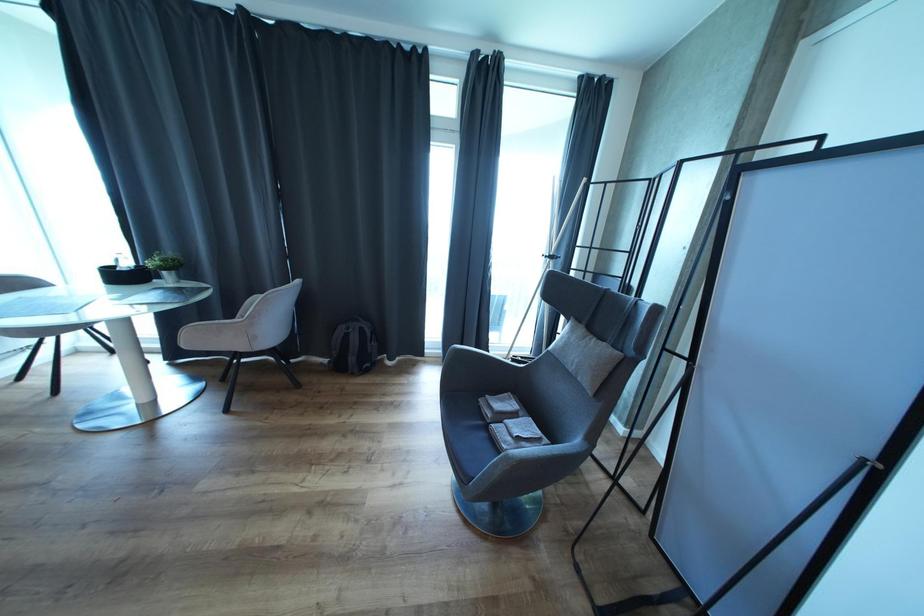
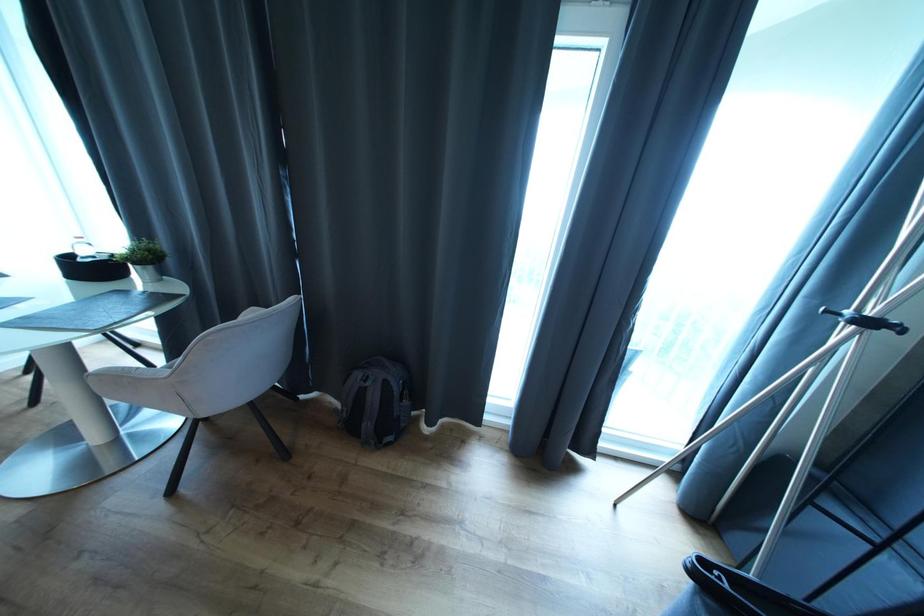
Question: Which direction would the cameraman need to move to produce the second image? Reply with the corresponding letter.

Choices:
 (A) Left
 (B) Right
 (C) Forward
 (D) Backward

Answer: (C)